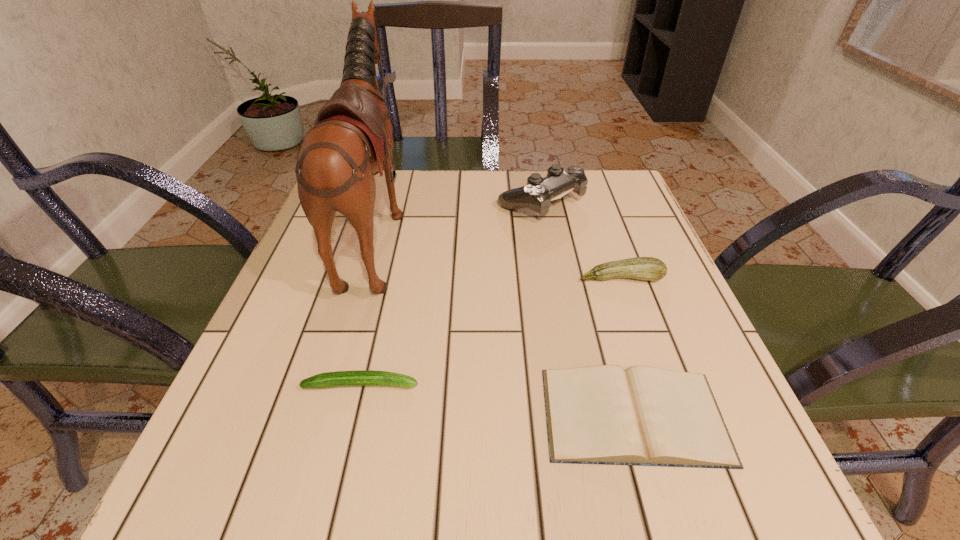
Find the location of a particular element. saddle is located at coordinates (352, 140).

Find the location of a particular element. control is located at coordinates 536,195.

Where is `the taller zucchini`? the taller zucchini is located at coordinates (642, 268).

The width and height of the screenshot is (960, 540). In order to click on the right zucchini in this screenshot , I will do `click(642, 268)`.

At what (x,y) coordinates should I click in order to perform the action: click on the nearer zucchini. Please return your answer as a coordinate pair (x, y). This screenshot has width=960, height=540. Looking at the image, I should click on (358, 377).

The height and width of the screenshot is (540, 960). In order to click on the left zucchini in this screenshot , I will do `click(358, 377)`.

Where is `Bible`? The width and height of the screenshot is (960, 540). Bible is located at coordinates (643, 416).

In order to click on free space located on the back of the saddle in this screenshot , I will do `click(505, 233)`.

The width and height of the screenshot is (960, 540). I want to click on blank space located on the right of the second tallest object, so point(621,201).

Identify the location of free space located 0.310m at the stem end of the right zucchini. (676, 433).